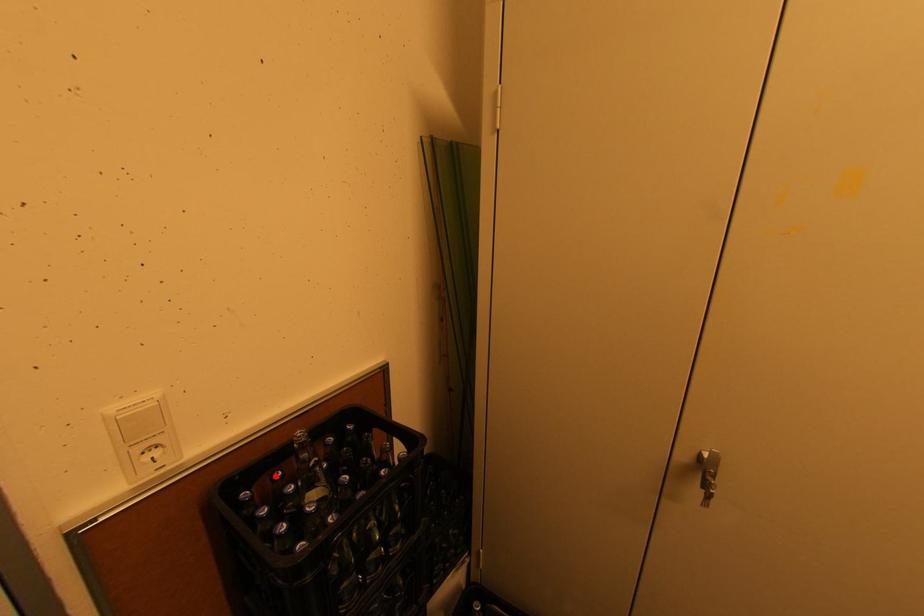
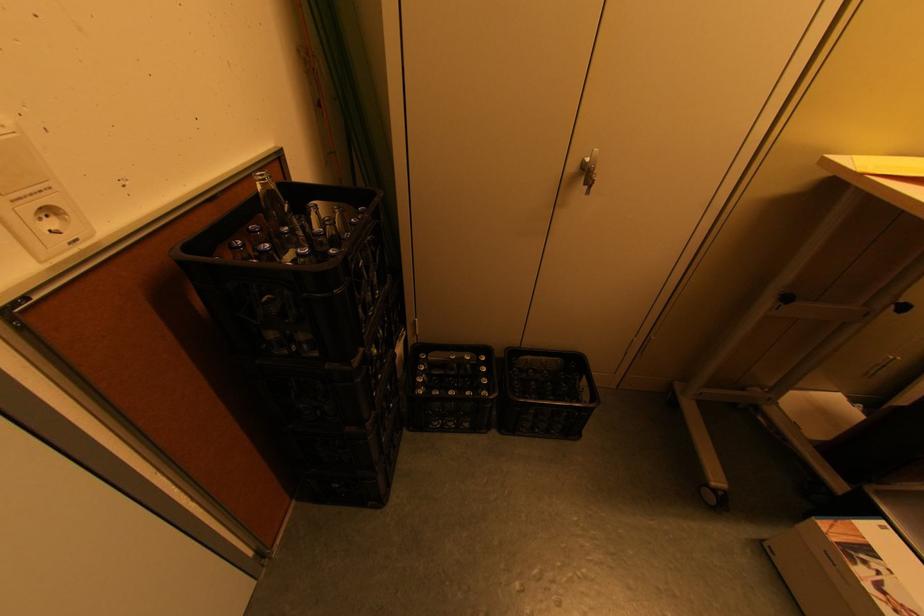
The point at the highlighted location is marked in the first image. Where is the corresponding point in the second image?

(234, 244)